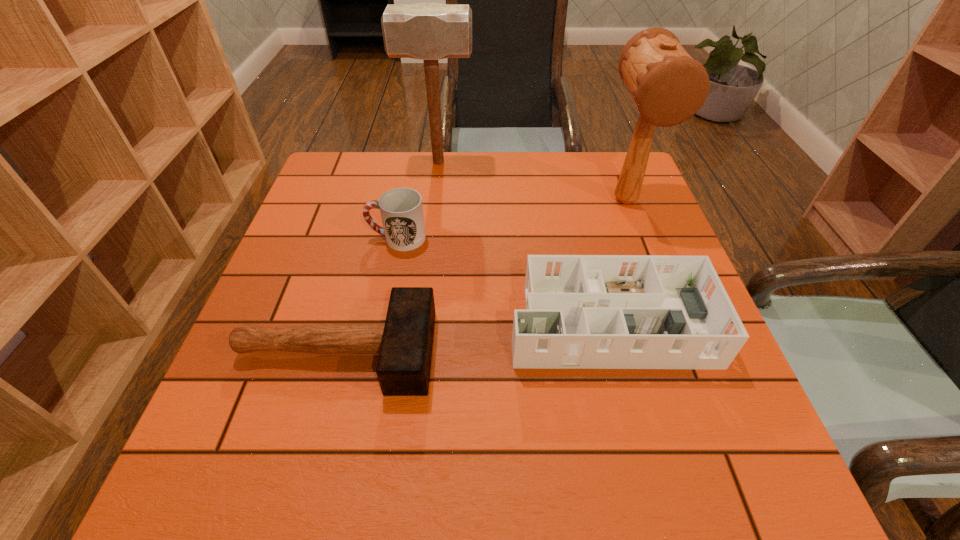
This screenshot has height=540, width=960. I want to click on vacant area situated on the side of the cup where the handle is located, so click(x=296, y=238).

Identify the location of vacant region located 0.350m on the back of the dollhouse. The width and height of the screenshot is (960, 540). (572, 183).

Where is `vacant space located 0.110m on the hammer head face of the shortest object`? The width and height of the screenshot is (960, 540). vacant space located 0.110m on the hammer head face of the shortest object is located at coordinates (489, 352).

Image resolution: width=960 pixels, height=540 pixels. In order to click on object located at the left edge in this screenshot , I will do `click(404, 343)`.

The width and height of the screenshot is (960, 540). I want to click on mallet that is at the right edge, so click(x=668, y=86).

I want to click on dollhouse that is at the right edge, so click(x=582, y=311).

This screenshot has width=960, height=540. What are the coordinates of `object present at the far right corner` in the screenshot? It's located at (668, 86).

I want to click on vacant space at the far edge, so click(450, 189).

In the image, there is a desktop. Identify the location of vacant space at the near edge. The width and height of the screenshot is (960, 540). (510, 470).

Locate an element on the screen. free space at the left edge is located at coordinates (326, 298).